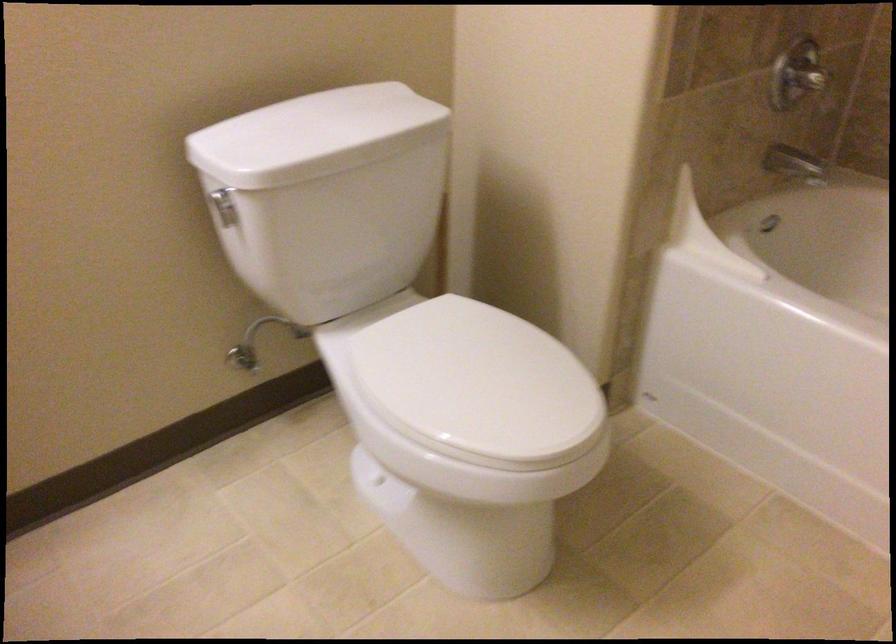
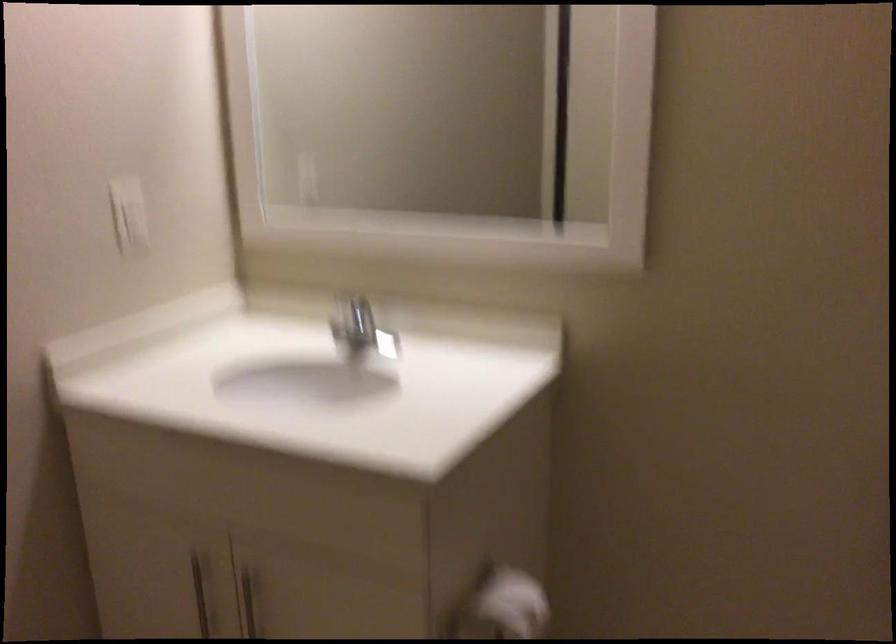
Question: Based on the continuous images, in which direction is the camera rotating? Reply with the corresponding letter.

Choices:
 (A) Left
 (B) Right
 (C) Up
 (D) Down

Answer: (A)